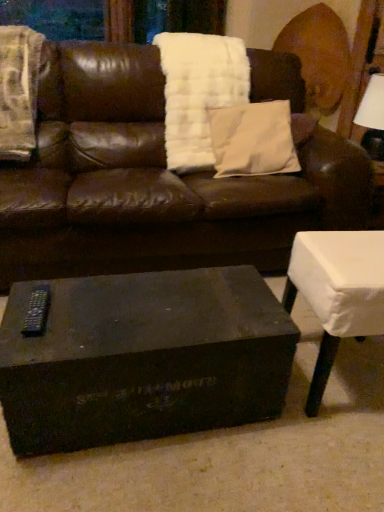
I want to click on free space below white cloth-covered table at lower right (from a real-world perspective), so click(x=342, y=376).